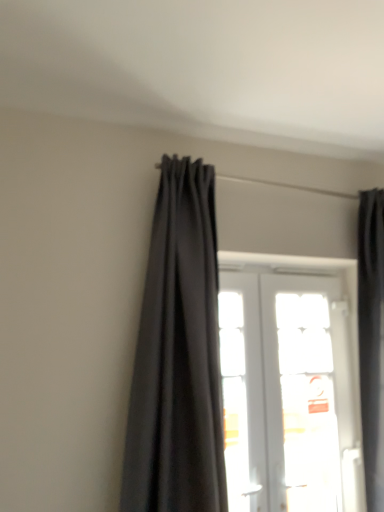
Question: Considering the positions of white glossy door at center and dark gray fabric curtain at center in the image, is white glossy door at center wider or thinner than dark gray fabric curtain at center?

Choices:
 (A) thin
 (B) wide

Answer: (A)

Question: Is white glossy door at center taller or shorter than dark gray fabric curtain at center?

Choices:
 (A) tall
 (B) short

Answer: (B)

Question: Would you say white glossy door at center is inside or outside dark gray fabric curtain at center?

Choices:
 (A) inside
 (B) outside

Answer: (B)

Question: Choose the correct answer: Is dark gray fabric curtain at center inside white glossy door at center or outside it?

Choices:
 (A) outside
 (B) inside

Answer: (A)

Question: In the image, is dark gray fabric curtain at center positioned in front of or behind white glossy door at center?

Choices:
 (A) behind
 (B) front

Answer: (B)

Question: Considering the positions of point (x=167, y=430) and point (x=266, y=367), is point (x=167, y=430) closer or farther from the camera than point (x=266, y=367)?

Choices:
 (A) closer
 (B) farther

Answer: (A)

Question: From a real-world perspective, is dark gray fabric curtain at center positioned above or below white glossy door at center?

Choices:
 (A) above
 (B) below

Answer: (A)